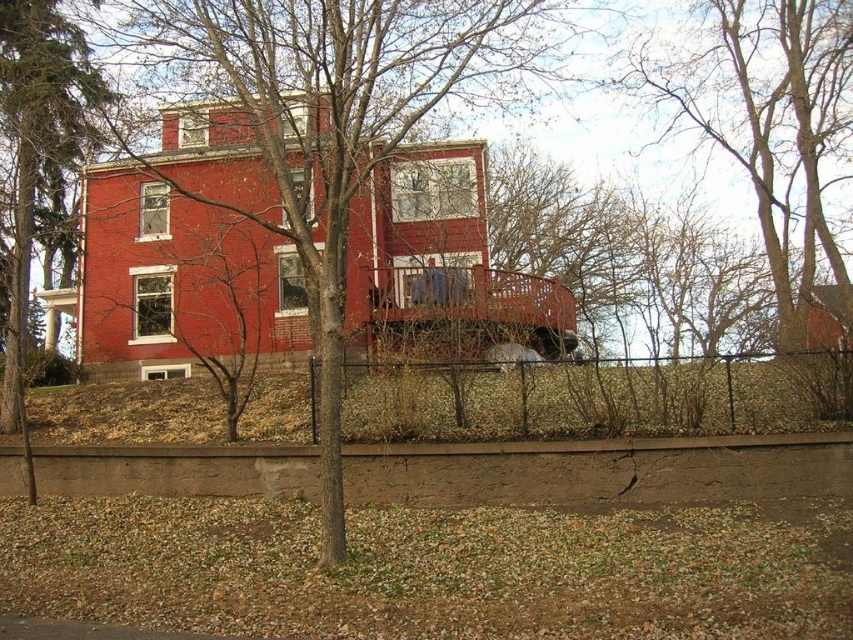
Question: Which of these objects is positioned farthest from the black metal fence at lower center?

Choices:
 (A) bare branches at upper center
 (B) bare branches at center

Answer: (A)

Question: Is bare branches at center above black metal fence at lower center?

Choices:
 (A) no
 (B) yes

Answer: (B)

Question: Which object is closer to the camera taking this photo?

Choices:
 (A) black metal fence at lower center
 (B) bare branches at center

Answer: (B)

Question: Can you confirm if bare branches at center is smaller than bare branches at upper center?

Choices:
 (A) yes
 (B) no

Answer: (B)

Question: Which object appears farthest from the camera in this image?

Choices:
 (A) black metal fence at lower center
 (B) bare branches at center

Answer: (A)

Question: Does bare branches at center appear under black metal fence at lower center?

Choices:
 (A) yes
 (B) no

Answer: (B)